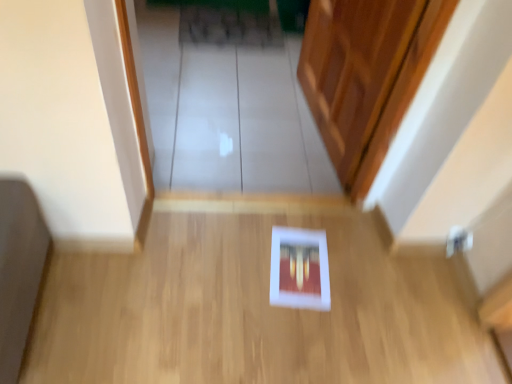
Identify the location of transparent glass door at center. This screenshot has height=384, width=512. (228, 114).

Image resolution: width=512 pixels, height=384 pixels. What do you see at coordinates (228, 114) in the screenshot? I see `transparent glass door at center` at bounding box center [228, 114].

What do you see at coordinates (253, 311) in the screenshot? This screenshot has width=512, height=384. I see `white matte book at center` at bounding box center [253, 311].

Find the location of a particular element. white matte book at center is located at coordinates (253, 311).

Locate an element on the screen. transparent glass door at center is located at coordinates (228, 114).

Which is more to the left, transparent glass door at center or white matte book at center?

transparent glass door at center.

Is the position of transparent glass door at center less distant than that of white matte book at center?

No, it is behind white matte book at center.

Is point (227, 104) farther from viewer compared to point (52, 363)?

Yes, it is behind point (52, 363).

From the image's perspective, who appears lower, transparent glass door at center or white matte book at center?

white matte book at center is shown below in the image.

From a real-world perspective, which object stands above the other?

From a 3D spatial view, white matte book at center is above.

Can you confirm if transparent glass door at center is thinner than white matte book at center?

In fact, transparent glass door at center might be wider than white matte book at center.

Can you confirm if transparent glass door at center is taller than white matte book at center?

No, transparent glass door at center is not taller than white matte book at center.

Who is bigger, transparent glass door at center or white matte book at center?

With larger size is white matte book at center.

Based on the photo, is transparent glass door at center not inside white matte book at center?

Absolutely, transparent glass door at center is external to white matte book at center.

Is transparent glass door at center not close to white matte book at center?

No, there isn't a large distance between transparent glass door at center and white matte book at center.

Is transparent glass door at center oriented away from white matte book at center?

transparent glass door at center is not turned away from white matte book at center.

What's the angular difference between transparent glass door at center and white matte book at center's facing directions?

180 degrees separate the facing orientations of transparent glass door at center and white matte book at center.

At what (x,y) coordinates should I click in order to perform the action: click on corridor in front of the transparent glass door at center. Please return your answer as a coordinate pair (x, y). This screenshot has width=512, height=384. Looking at the image, I should click on (253, 311).

Considering the relative positions of white matte book at center and transparent glass door at center in the image provided, is white matte book at center to the right of transparent glass door at center from the viewer's perspective?

Indeed, white matte book at center is positioned on the right side of transparent glass door at center.

Which object is more forward, white matte book at center or transparent glass door at center?

white matte book at center is more forward.

Is point (347, 268) positioned behind point (231, 65)?

No, it is in front of (231, 65).

From the image's perspective, is white matte book at center located beneath transparent glass door at center?

Indeed, from the image's perspective, white matte book at center is shown beneath transparent glass door at center.

From a real-world perspective, does white matte book at center stand above transparent glass door at center?

Indeed, from a real-world perspective, white matte book at center stands above transparent glass door at center.

Considering the sizes of objects white matte book at center and transparent glass door at center in the image provided, who is wider, white matte book at center or transparent glass door at center?

transparent glass door at center is wider.

Is white matte book at center shorter than transparent glass door at center?

Incorrect, the height of white matte book at center does not fall short of that of transparent glass door at center.

Considering the sizes of objects white matte book at center and transparent glass door at center in the image provided, who is bigger, white matte book at center or transparent glass door at center?

white matte book at center is bigger.

Would you say transparent glass door at center is part of white matte book at center's contents?

No, transparent glass door at center is not a part of white matte book at center.

Consider the image. Is white matte book at center with transparent glass door at center?

No, white matte book at center is not with transparent glass door at center.

Is transparent glass door at center at the back of white matte book at center?

No, transparent glass door at center is not at the back of white matte book at center.

I want to click on corridor above the transparent glass door at center (from a real-world perspective), so click(x=253, y=311).

Locate an element on the screen. glass door behind the white matte book at center is located at coordinates (228, 114).

Find the location of `glass door located on the left of white matte book at center`. glass door located on the left of white matte book at center is located at coordinates (228, 114).